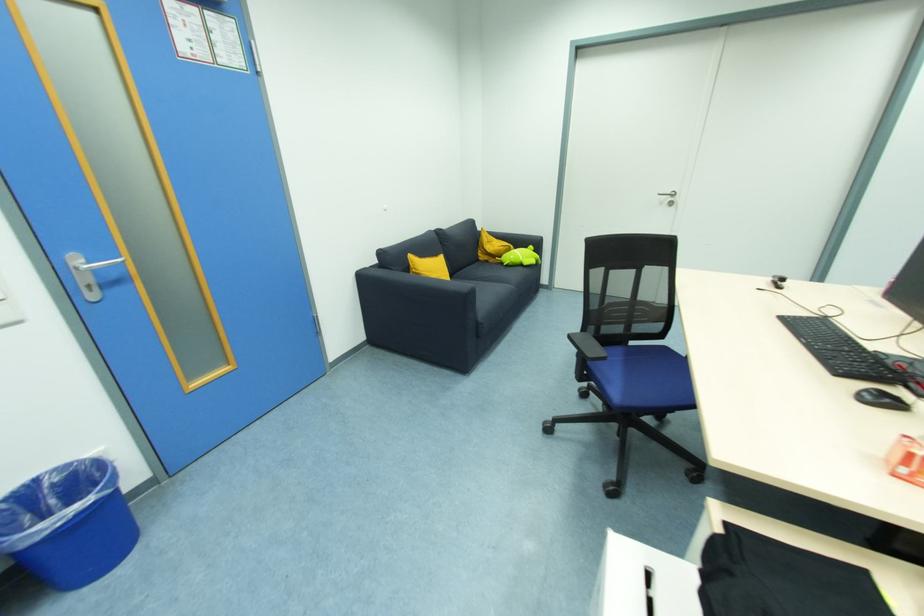
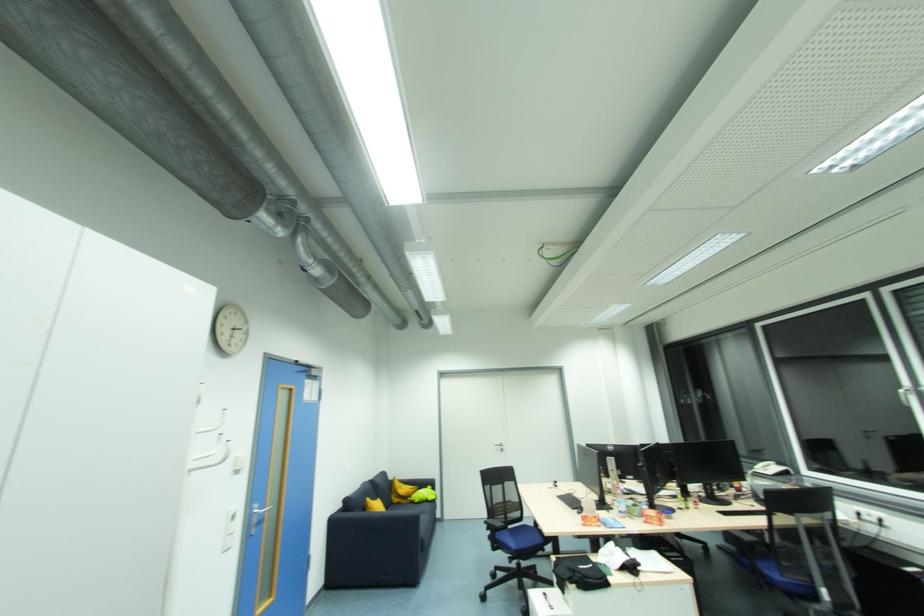
Find the pixel in the second image that matches the point at 99,273 in the first image.

(261, 517)